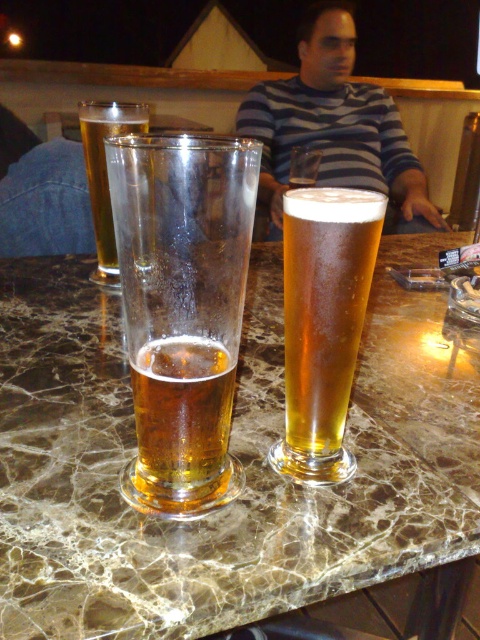
Question: In this image, where is translucent glass beer at left located relative to clear glass beer at center?

Choices:
 (A) above
 (B) below

Answer: (B)

Question: Does marble table at center have a greater width compared to translucent glass beer at left?

Choices:
 (A) yes
 (B) no

Answer: (A)

Question: Is the position of marble table at center less distant than that of translucent glass beer at left?

Choices:
 (A) no
 (B) yes

Answer: (B)

Question: Based on their relative distances, which object is nearer to the clear glass beer at center?

Choices:
 (A) translucent glass beer at left
 (B) striped shirt at center
 (C) translucent glass beer at center

Answer: (A)

Question: Which object appears closest to the camera in this image?

Choices:
 (A) translucent glass beer at center
 (B) striped shirt at center
 (C) marble table at center
 (D) clear glass beer at center

Answer: (C)

Question: Which object is the closest to the marble table at center?

Choices:
 (A) striped shirt at center
 (B) translucent glass beer at left

Answer: (B)